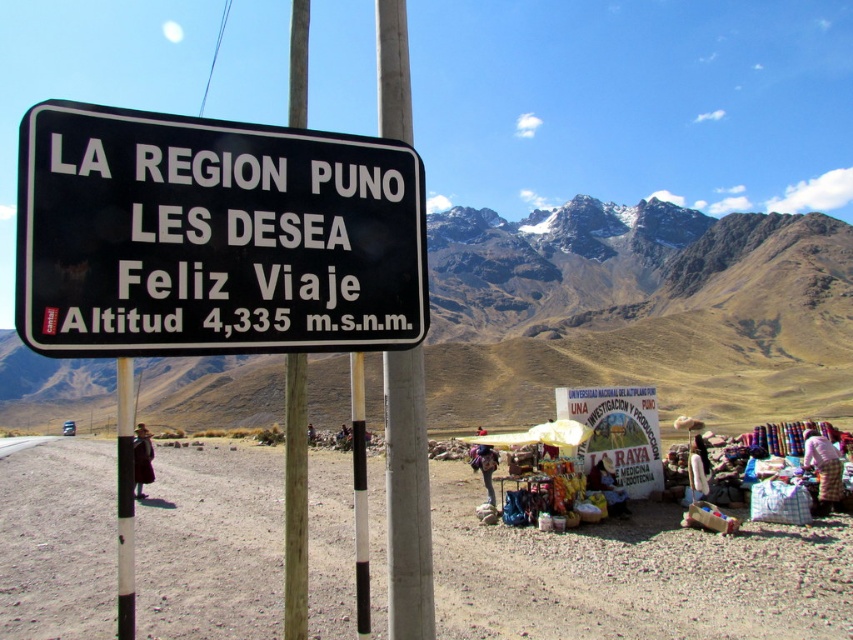
Is brown rocky mountain at upper center positioned in front of black plastic sign at center?

No, it is not.

Which is more to the left, brown rocky mountain at upper center or black plastic sign at center?

brown rocky mountain at upper center

Who is more forward, (x=531, y=228) or (x=161, y=204)?

Positioned in front is point (x=161, y=204).

Find the location of a particular element. brown rocky mountain at upper center is located at coordinates (637, 310).

Which of these two, dusty sand at lower right or white painted metal pole at center, stands shorter?

dusty sand at lower right

Which is above, dusty sand at lower right or white painted metal pole at center?

white painted metal pole at center is higher up.

Image resolution: width=853 pixels, height=640 pixels. I want to click on dusty sand at lower right, so click(x=634, y=577).

The width and height of the screenshot is (853, 640). Identify the location of dusty sand at lower right. (634, 577).

Identify the location of black plastic sign at center. (212, 236).

Between point (260, 308) and point (410, 618), which one is positioned in front?

Point (260, 308) is in front.

Which is in front, point (170, 193) or point (402, 49)?

Point (170, 193) is more forward.

At what (x,y) coordinates should I click in order to perform the action: click on black plastic sign at center. Please return your answer as a coordinate pair (x, y). Looking at the image, I should click on (212, 236).